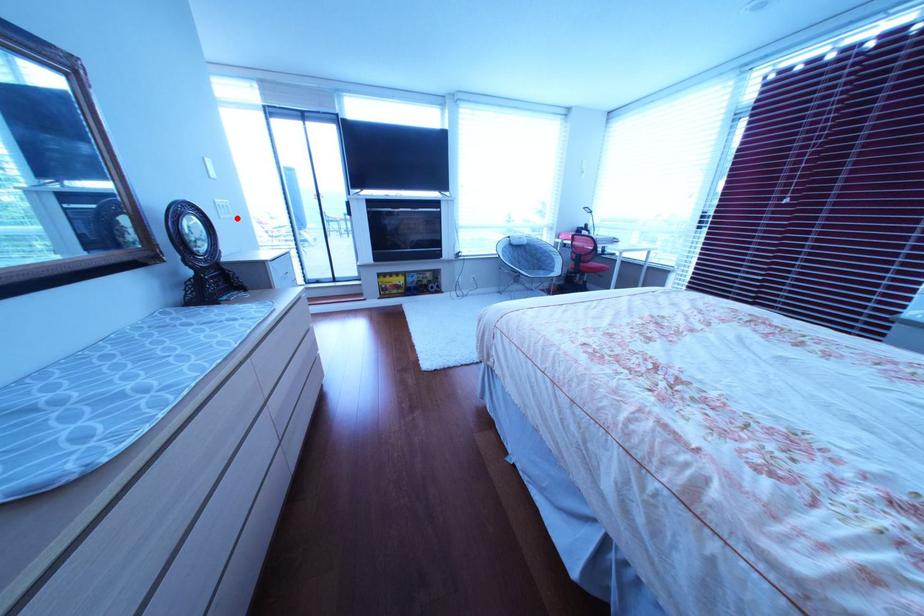
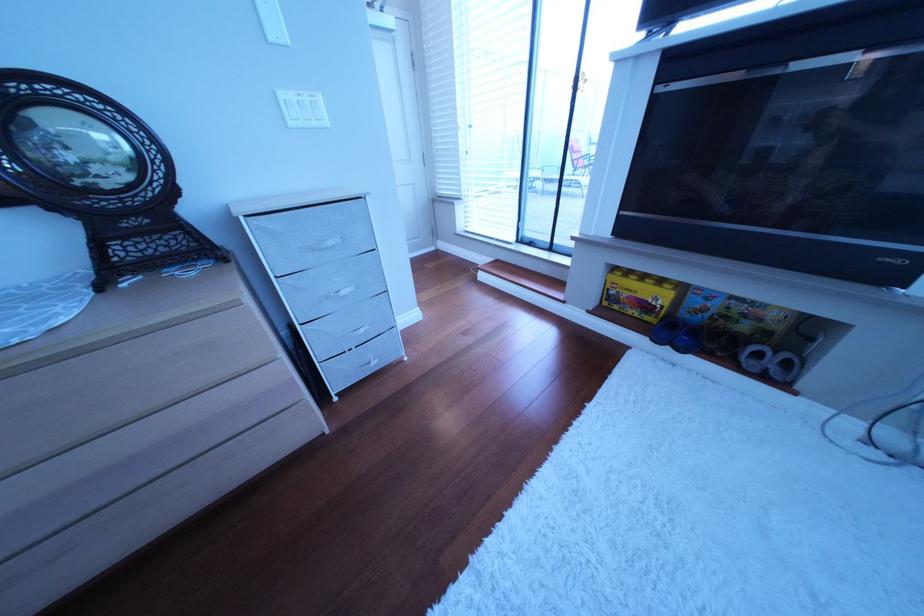
Where in the second image is the point corresponding to the highlighted location from the first image?

(307, 126)